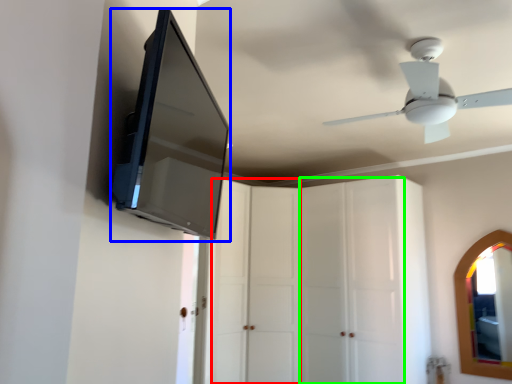
Question: Which object is the farthest from glass door (highlighted by a red box)? Choose among these: medicine cabinet (highlighted by a blue box) or glass door (highlighted by a green box).

Choices:
 (A) medicine cabinet
 (B) glass door

Answer: (A)